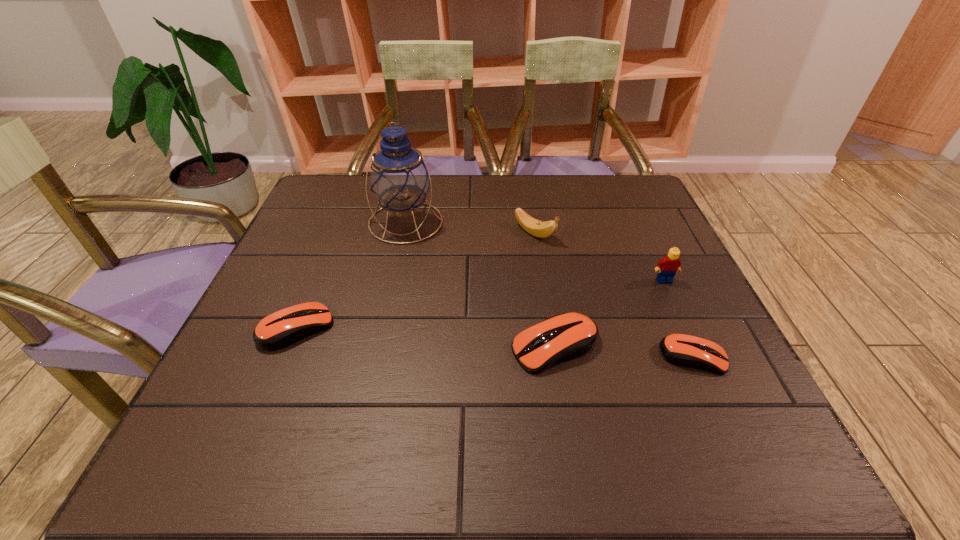
I want to click on vacant point located on the left of the second computer mouse from right to left, so click(388, 347).

The image size is (960, 540). Identify the location of free space located 0.190m on the back of the shortest computer mouse. (657, 276).

Image resolution: width=960 pixels, height=540 pixels. Find the location of `free space located on the front-facing side of the fifth object from right to left`. free space located on the front-facing side of the fifth object from right to left is located at coordinates (378, 350).

You are a GUI agent. You are given a task and a screenshot of the screen. Output one action in this format:
    pyautogui.click(x=<x>, y=<y>)
    Task: Click on the vacant region located on the left of the banana
    The width and height of the screenshot is (960, 540).
    Given the screenshot: What is the action you would take?
    pyautogui.click(x=437, y=233)

Where is `vacant point located on the front-facing side of the Lego`? Image resolution: width=960 pixels, height=540 pixels. vacant point located on the front-facing side of the Lego is located at coordinates (717, 395).

The width and height of the screenshot is (960, 540). Identify the location of object that is at the far edge. (399, 178).

This screenshot has width=960, height=540. In order to click on object that is at the left edge in this screenshot , I will do `click(285, 327)`.

What are the coordinates of `computer mouse that is positioned at the right edge` in the screenshot? It's located at (683, 350).

You are a GUI agent. You are given a task and a screenshot of the screen. Output one action in this format:
    pyautogui.click(x=<x>, y=<y>)
    Task: Click on the Lego present at the right edge
    
    Given the screenshot: What is the action you would take?
    pyautogui.click(x=667, y=267)

Find the location of a particular element. This screenshot has width=960, height=540. object at the near right corner is located at coordinates (683, 350).